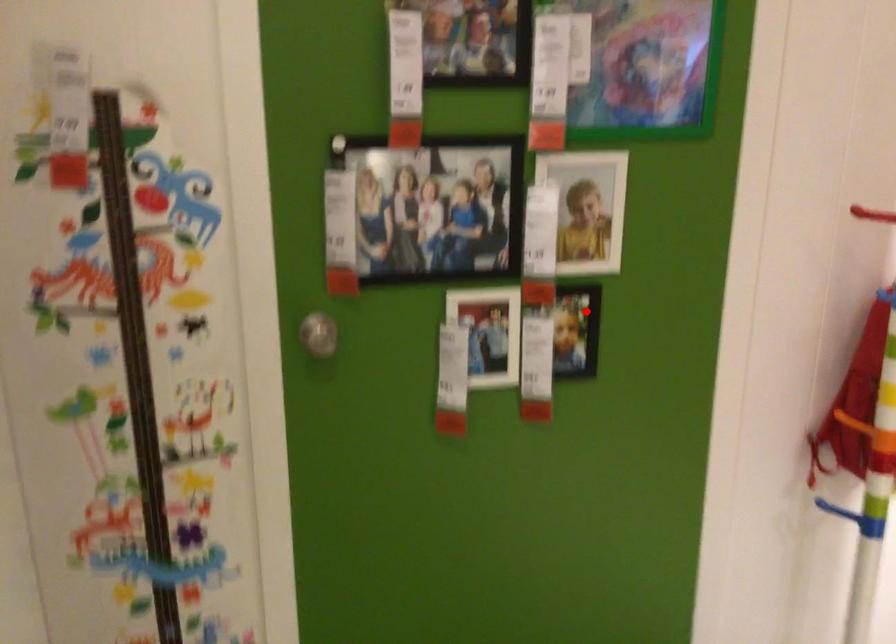
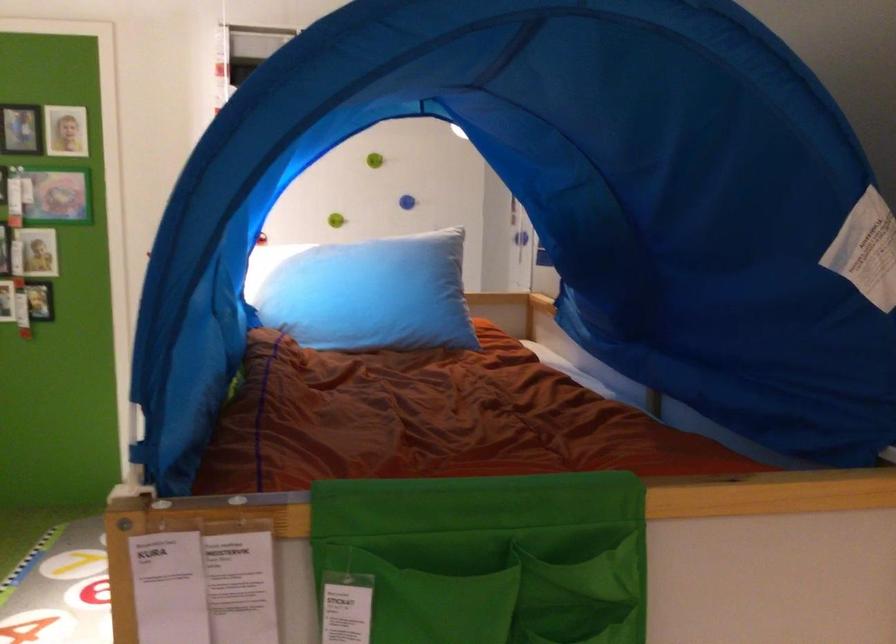
Question: I am providing you with two images of the same scene from different viewpoints. Given a red point in image1, look at the same physical point in image2. Is it:

Choices:
 (A) Closer to the viewpoint
 (B) Farther from the viewpoint

Answer: (B)